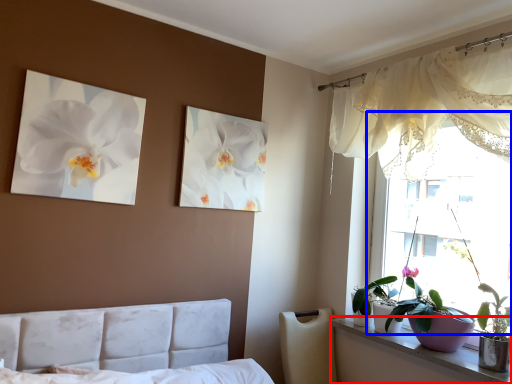
Question: Among these objects, which one is nearest to the camera, window sill (highlighted by a red box) or window (highlighted by a blue box)?

Choices:
 (A) window sill
 (B) window

Answer: (A)